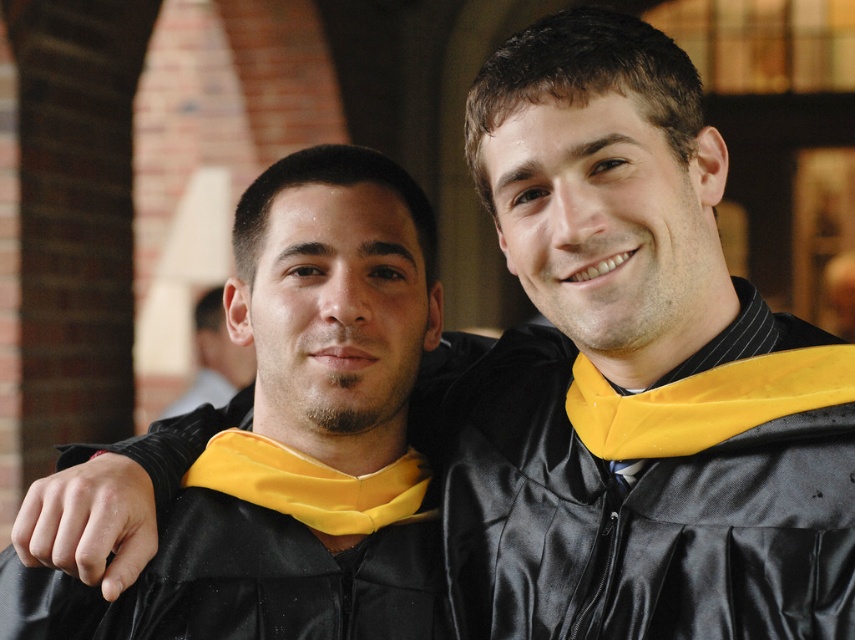
You are standing in front of a graduation photo where you see a matte black graduation gown at center. If you want to take a closer look at the gown, how many steps do you need to take forward to reach it?

The matte black graduation gown at center is 10.70 feet away. Assuming an average step length of about 2.5 feet, you would need to take approximately 4 steps forward to reach it.

You are standing in front of the graduation photo and want to touch the point that is closer to you. Which point should you choose between point (270, 460) and point (205, 401)?

Point (270, 460) is closer to the viewer than point (205, 401), so you should choose point (270, 460).